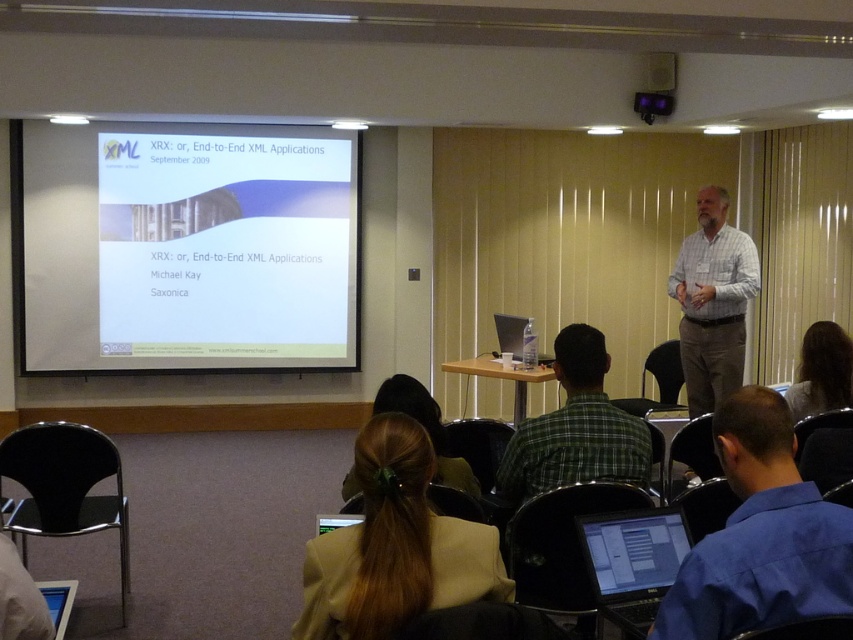
Based on the photo, you are an attendee in the conference room, and you need to pass a note to the presenter wearing the blue shirt at lower right without being noticed. The note is on your desk which is directly in front of the matte black laptop at lower center. Can you reach the presenter by extending your arm without getting up from your seat? Explain your reasoning.

The blue shirt at lower right and the matte black laptop at lower center are 21.06 inches apart. Since the average human arm length is about 25 inches, you can likely reach the presenter by extending your arm from the matte black laptop at lower center to the blue shirt at lower right without getting up.

You are an attendee sitting in the back row of the conference room. You want to ask a question to the presenter wearing the plaid shirt at center. The microphone on the podium is located near the brown hair at upper right. Can you estimate if you can reach the microphone by walking straight towards the presenter?

The plaid shirt at center is 3.45 feet away from brown hair at upper right. Since the microphone is near the brown hair at upper right, you would need to walk approximately 3.45 feet forward from the presenter to reach it. However, as an attendee in the back row, you are likely much farther away, so you would need to walk the entire distance from your seat to the front to reach the microphone.